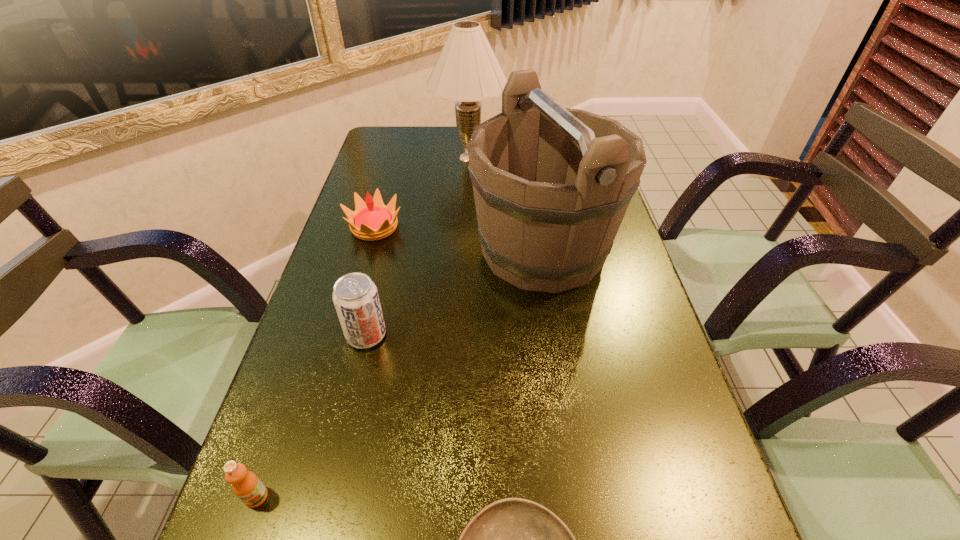
Locate an element on the screen. The width and height of the screenshot is (960, 540). free space between the bucket and the crown is located at coordinates (459, 239).

This screenshot has width=960, height=540. Find the location of `free space between the third tallest object and the bucket`. free space between the third tallest object and the bucket is located at coordinates (454, 292).

You are a GUI agent. You are given a task and a screenshot of the screen. Output one action in this format:
    pyautogui.click(x=<x>, y=<y>)
    Task: Click on the free space between the bucket and the crown
    
    Given the screenshot: What is the action you would take?
    pyautogui.click(x=459, y=239)

Identify the location of free space between the third tallest object and the orange juice. This screenshot has height=540, width=960. coord(311,416).

Select which object appears as the fourth closest to the third nearest object. Please provide its 2D coordinates. Your answer should be formatted as a tuple, i.e. [(x, y)], where the tuple contains the x and y coordinates of a point satisfying the conditions above.

[(513, 539)]

Locate which object ranks third in proximity to the third nearest object. Please provide its 2D coordinates. Your answer should be formatted as a tuple, i.e. [(x, y)], where the tuple contains the x and y coordinates of a point satisfying the conditions above.

[(246, 485)]